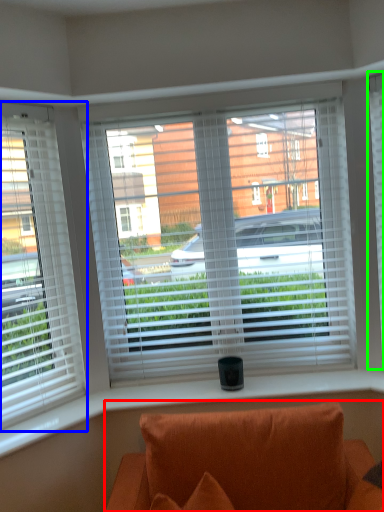
Question: Which is nearer to the studio couch (highlighted by a red box)? window (highlighted by a blue box) or window blind (highlighted by a green box).

Choices:
 (A) window
 (B) window blind

Answer: (A)